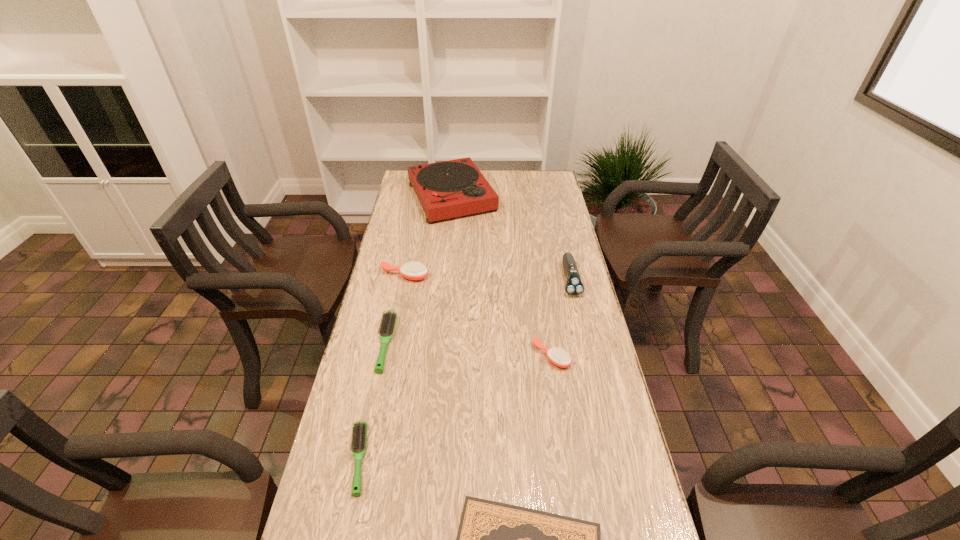
Find the location of a particular element. hairbrush present at the right edge is located at coordinates (557, 356).

The width and height of the screenshot is (960, 540). Find the location of `object that is at the far left corner`. object that is at the far left corner is located at coordinates [453, 188].

Locate an element on the screen. The width and height of the screenshot is (960, 540). free space at the far edge of the desktop is located at coordinates (517, 190).

What are the coordinates of `vacant space at the left edge` in the screenshot? It's located at (408, 253).

Identify the location of vacant space at the right edge of the desktop. (590, 313).

Identify the location of free space at the far left corner of the desktop. The image size is (960, 540). (399, 190).

Identify the location of vacant space at the far right corner of the desktop. This screenshot has width=960, height=540. (555, 185).

I want to click on blank region between the bigger orange hairbrush and the red record player, so click(x=428, y=236).

The image size is (960, 540). In order to click on free spot between the farther light hairbrush and the smaller light hairbrush in this screenshot , I will do coord(372,401).

The height and width of the screenshot is (540, 960). Find the location of `vacant space that's between the rightmost hairbrush and the sixth farthest object`. vacant space that's between the rightmost hairbrush and the sixth farthest object is located at coordinates (455, 408).